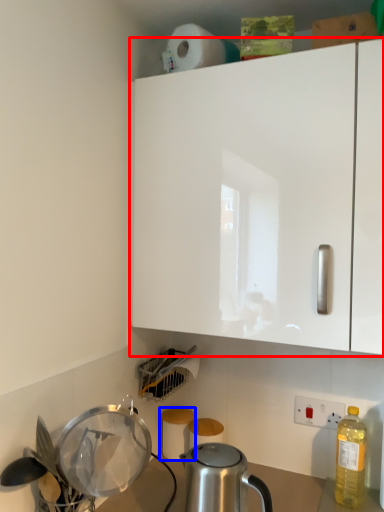
Question: Which object is further to the camera taking this photo, cabinetry (highlighted by a red box) or toilet paper (highlighted by a blue box)?

Choices:
 (A) cabinetry
 (B) toilet paper

Answer: (B)